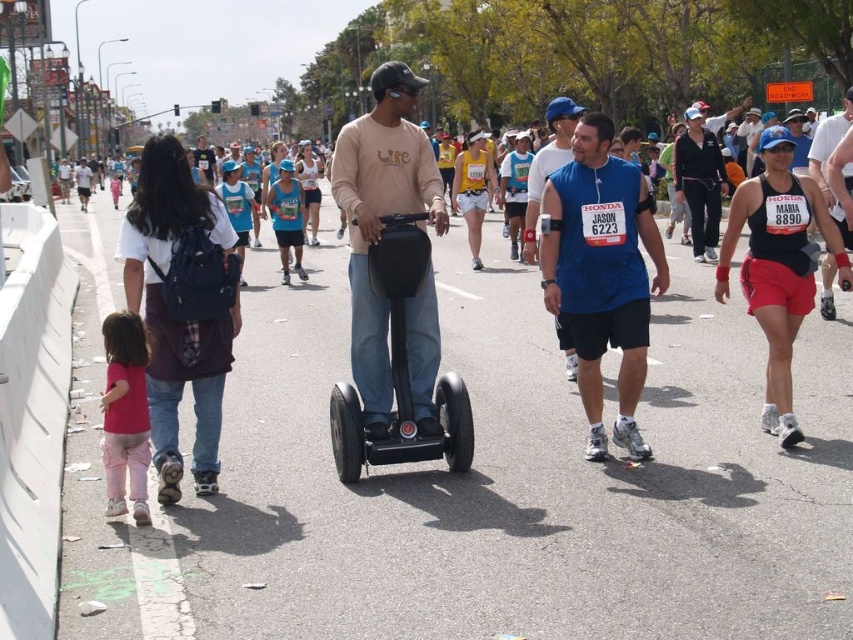
You are a photographer standing at the starting line of the marathon. You want to take a photo that includes both the matte beige sweatshirt at center and the matte blue tank top at right. Which participant will appear larger in your photo?

The matte beige sweatshirt at center will appear larger in the photo because it is closer to the viewer than the matte blue tank top at right.

In the scene shown: You are a photographer standing on the sidewalk and want to take a photo of the matte blue tank top at right and the matte black segway at center. If you want to ensure both subjects are fully visible in the frame, which subject should you position closer to the edge of the photo?

The matte blue tank top at right has a lesser width compared to the matte black segway at center, so you should position the matte blue tank top at right closer to the edge of the photo to ensure both are fully visible.

You are a photographer at the marathon event and want to capture both the matte beige sweatshirt at center and the matte blue tank top at right in a single shot. Given their sizes, which one should you focus on to ensure both are clearly visible in the frame?

The matte beige sweatshirt at center is larger in size than the matte blue tank top at right, so focusing on the matte beige sweatshirt at center would help ensure both are clearly visible as it takes up more space in the frame.